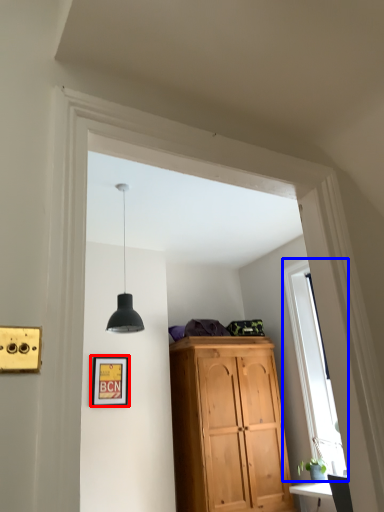
Question: Which object appears farthest to the camera in this image, picture frame (highlighted by a red box) or window (highlighted by a blue box)?

Choices:
 (A) picture frame
 (B) window

Answer: (A)